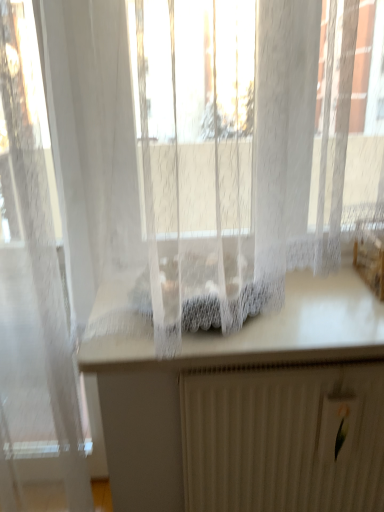
Question: From the image's perspective, is white matte radiator at lower center located above or below white lace curtain at center?

Choices:
 (A) below
 (B) above

Answer: (A)

Question: In the image, is white matte radiator at lower center positioned in front of or behind white lace curtain at center?

Choices:
 (A) behind
 (B) front

Answer: (A)

Question: From a real-world perspective, relative to white lace curtain at center, is white matte radiator at lower center vertically above or below?

Choices:
 (A) above
 (B) below

Answer: (B)

Question: Based on their sizes in the image, would you say white lace curtain at center is bigger or smaller than white matte radiator at lower center?

Choices:
 (A) big
 (B) small

Answer: (A)

Question: Choose the correct answer: Is white lace curtain at center inside white matte radiator at lower center or outside it?

Choices:
 (A) inside
 (B) outside

Answer: (B)

Question: Relative to white matte radiator at lower center, is white lace curtain at center in front or behind?

Choices:
 (A) behind
 (B) front

Answer: (B)

Question: Is point (91, 372) closer or farther from the camera than point (218, 439)?

Choices:
 (A) farther
 (B) closer

Answer: (B)